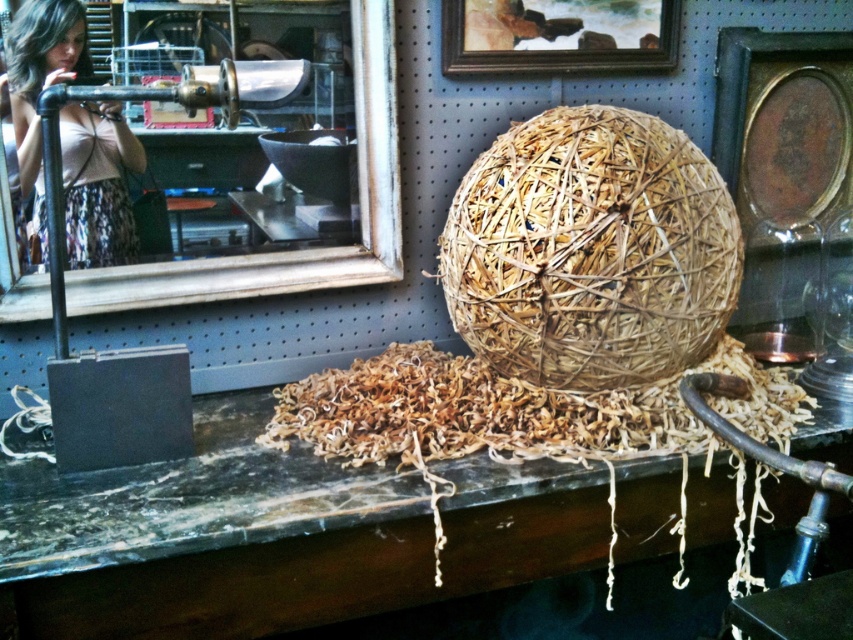
You are an interior designer planning to place a decorative item between the natural straw ball at center and the wooden frame at upper center. Considering their sizes, which object should you place closer to the smaller one to maintain balance?

The wooden frame at upper center is smaller than the natural straw ball at center. To maintain balance, place the decorative item closer to the wooden frame at upper center since it is smaller.

You are standing in front of the rustic display setup. There are two points marked in the image. The first point is at coordinates point (142,580) and the second point is at point (654,268). Which of these two points is nearer to you?

Point (142,580) is closer to the viewer than point (654,268).